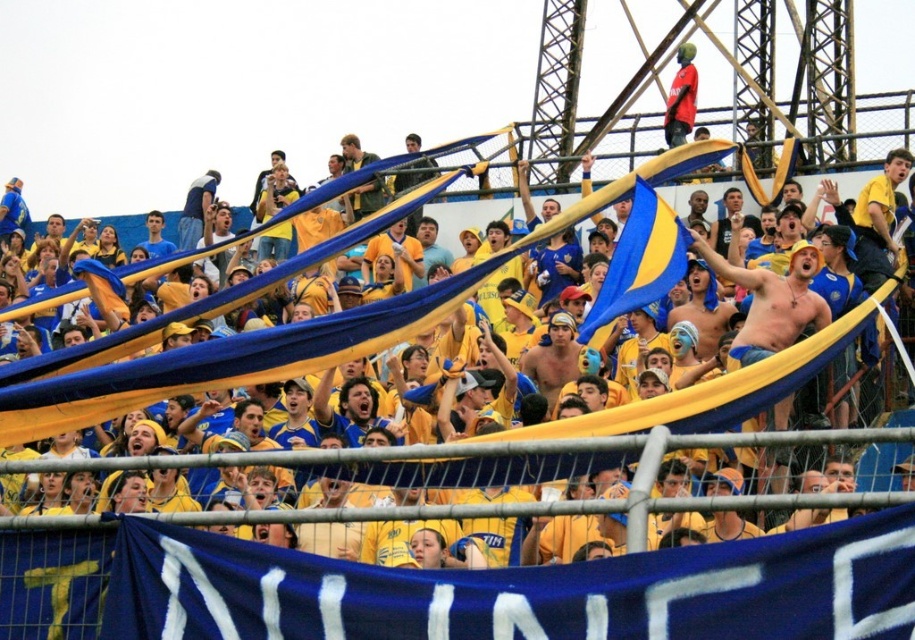
Between blue/yellow fabric banner at upper center and blue/yellow fabric flag at center, which one is positioned higher?

blue/yellow fabric flag at center

Which is behind, point (740, 381) or point (684, 273)?

The point (684, 273) is behind.

What do you see at coordinates (286, 333) in the screenshot? Image resolution: width=915 pixels, height=640 pixels. I see `blue/yellow fabric banner at upper center` at bounding box center [286, 333].

Find the location of a particular element. The width and height of the screenshot is (915, 640). blue/yellow fabric banner at upper center is located at coordinates (286, 333).